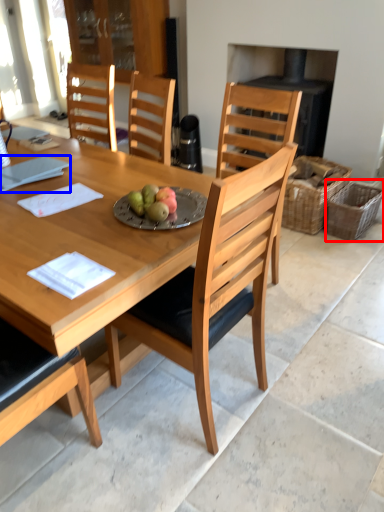
Question: Which of the following is the farthest to the observer, picnic basket (highlighted by a red box) or notepad (highlighted by a blue box)?

Choices:
 (A) picnic basket
 (B) notepad

Answer: (A)